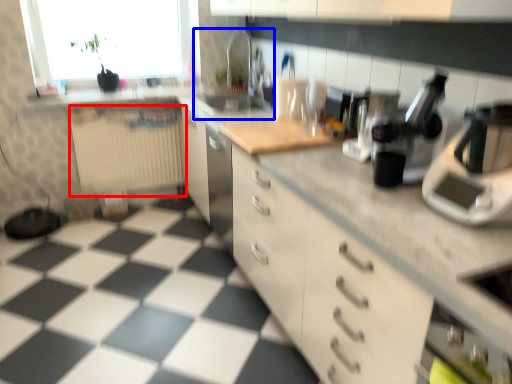
Question: Which object is further to the camera taking this photo, radiator (highlighted by a red box) or sink (highlighted by a blue box)?

Choices:
 (A) radiator
 (B) sink

Answer: (A)